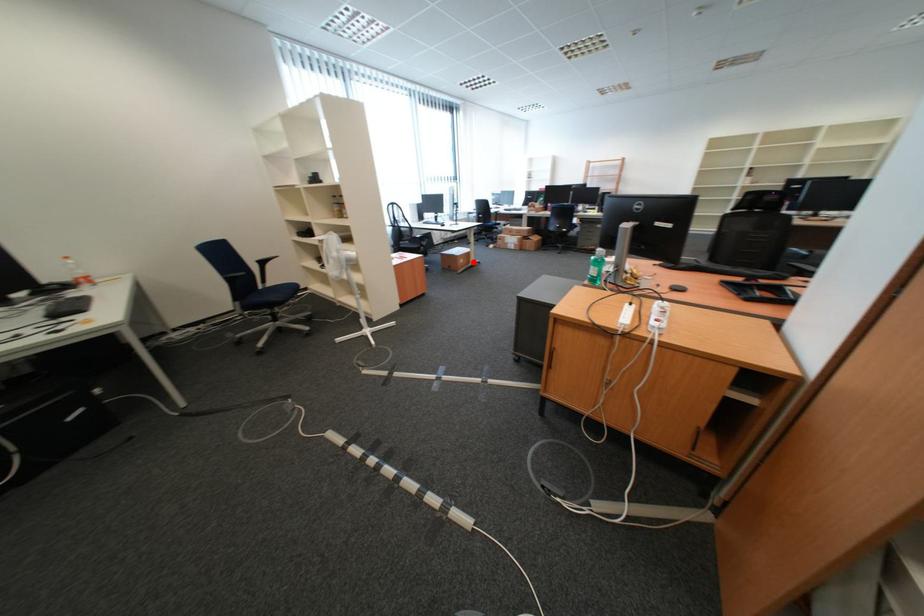
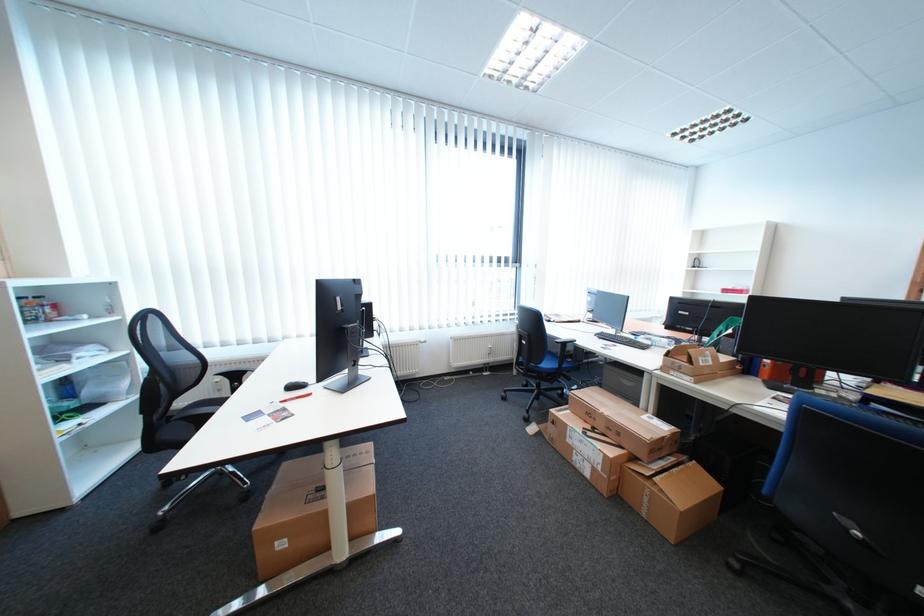
Question: A red point is marked in image1. In image2, is the corresponding 3D point closer to the camera or farther? Reply with the corresponding letter.

Choices:
 (A) The corresponding 3D point is closer.
 (B) The corresponding 3D point is farther.

Answer: (B)